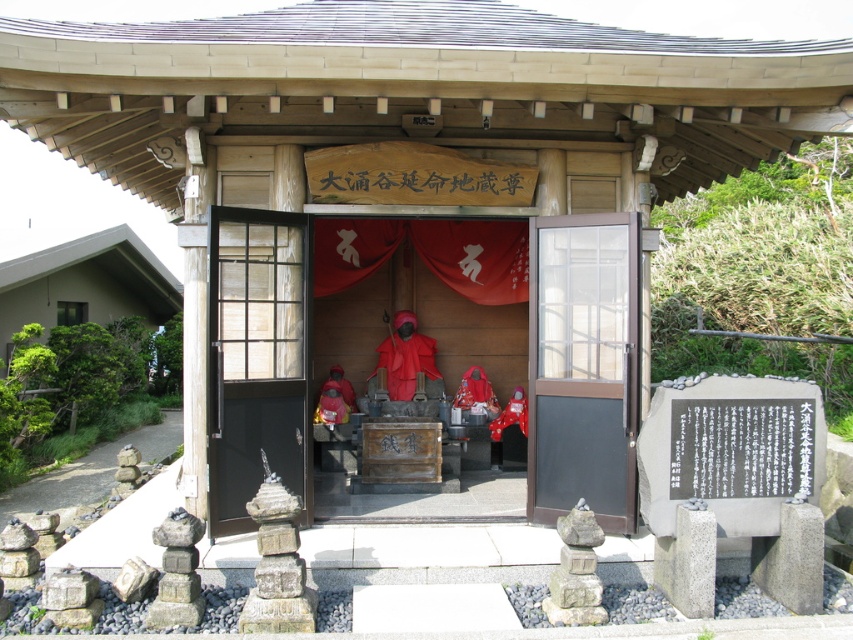
Between brown wooden door at center and red matte statue at center, which one appears on the right side from the viewer's perspective?

Positioned to the right is brown wooden door at center.

Does brown wooden door at center appear on the right side of red matte statue at center?

Yes, brown wooden door at center is to the right of red matte statue at center.

What do you see at coordinates (583, 365) in the screenshot?
I see `brown wooden door at center` at bounding box center [583, 365].

You are a GUI agent. You are given a task and a screenshot of the screen. Output one action in this format:
    pyautogui.click(x=<x>, y=<y>)
    Task: Click on the brown wooden door at center
    The image size is (853, 640).
    Given the screenshot: What is the action you would take?
    pyautogui.click(x=583, y=365)

Measure the distance from red matte statue at center to matte red statue at center.

A distance of 66.29 centimeters exists between red matte statue at center and matte red statue at center.

Is red matte statue at center to the right of matte red statue at center from the viewer's perspective?

Correct, you'll find red matte statue at center to the right of matte red statue at center.

Identify the location of red matte statue at center. The height and width of the screenshot is (640, 853). (408, 358).

Does black glass door at center lie behind red matte statue at center?

No, it is in front of red matte statue at center.

Between point (251, 358) and point (440, 390), which one is positioned in front?

Positioned in front is point (251, 358).

This screenshot has height=640, width=853. I want to click on black glass door at center, so point(254,356).